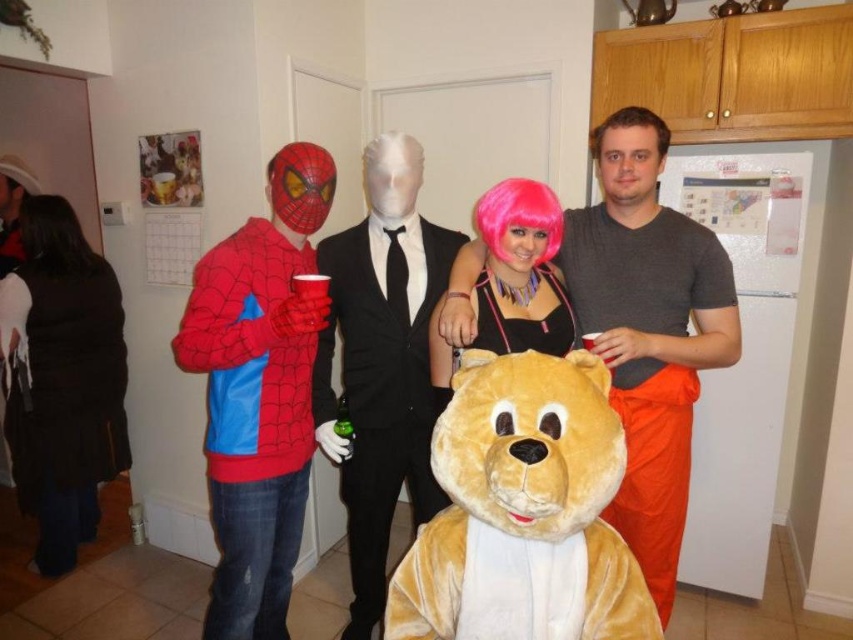
You are a photographer setting up for a themed party photo shoot in the kitchen. You have a velvet golden bear at center and a pink synthetic wig at center in your frame. The distance between them is crucial for your composition. Can you fit both items within a 4 feet wide backdrop without overlapping?

The velvet golden bear at center and pink synthetic wig at center are 3.76 feet apart from each other. Since the required distance is within the 4 feet width of the backdrop, both items can be placed without overlapping.

You are a photographer setting up for a group photo. You need to ensure that all subjects are visible in the frame. Given that the velvet golden bear at center and the pink synthetic wig at center are the main focuses, which one should be positioned higher to avoid blocking the other?

The velvet golden bear at center is taller than the pink synthetic wig at center, so to avoid blocking, the pink synthetic wig at center should be positioned higher to stay visible above the velvet golden bear at center.